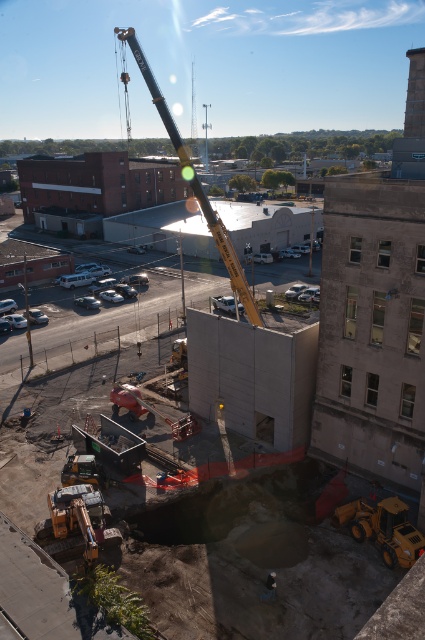
Is yellow rubber tractor at lower right further to camera compared to orange rubber crane at center?

No, it is not.

In order to click on yellow rubber tractor at lower right in this screenshot , I will do `click(384, 529)`.

Which is more to the right, orange metallic excavator at lower left or blue fabric construction worker at lower center?

Positioned to the right is blue fabric construction worker at lower center.

Does orange metallic excavator at lower left come in front of blue fabric construction worker at lower center?

No, orange metallic excavator at lower left is behind blue fabric construction worker at lower center.

Image resolution: width=425 pixels, height=640 pixels. What are the coordinates of `orange metallic excavator at lower left` in the screenshot? It's located at (74, 524).

Locate an element on the screen. The height and width of the screenshot is (640, 425). orange metallic excavator at lower left is located at coordinates (74, 524).

Who is more forward, (192,413) or (274,588)?

Point (274,588) is in front.

Can you confirm if orange rubber crane at center is positioned above blue fabric construction worker at lower center?

Indeed, orange rubber crane at center is positioned over blue fabric construction worker at lower center.

Measure the distance between point [184,422] and camera.

122.00 feet

Where is `orange rubber crane at center`? This screenshot has height=640, width=425. orange rubber crane at center is located at coordinates (169, 419).